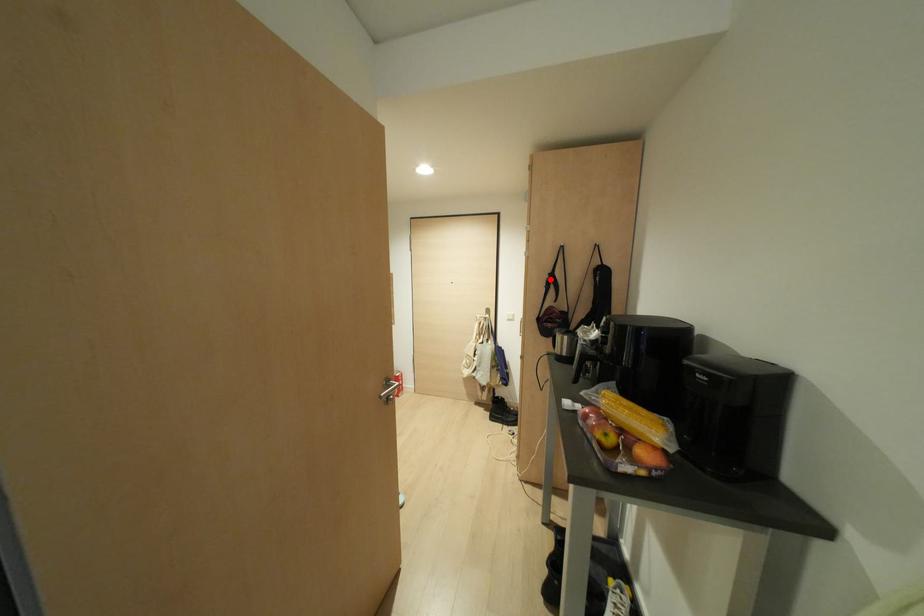
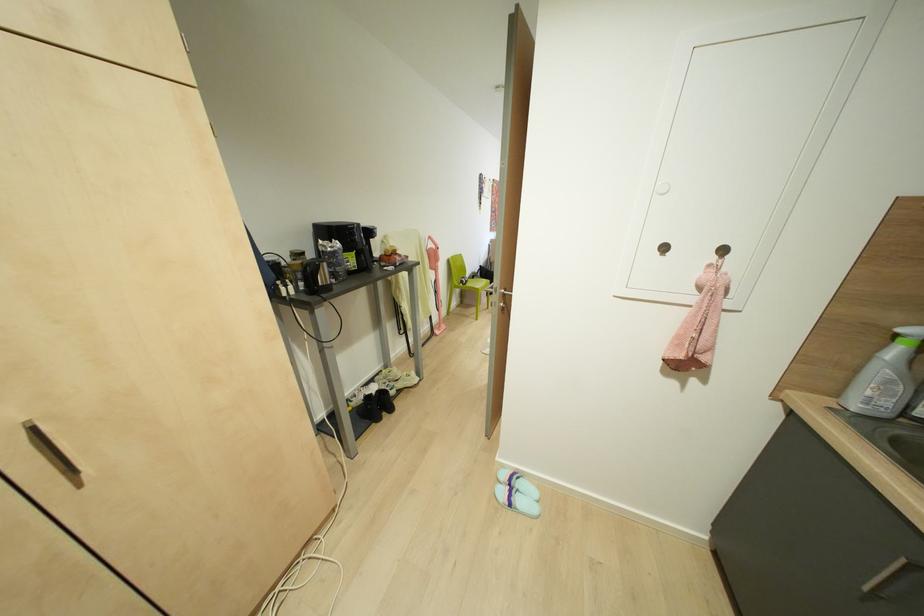
Question: I am providing you with two images of the same scene from different viewpoints. A red point is marked on the first image. Can you still see the location of the red point in image 2?

Choices:
 (A) Yes
 (B) No

Answer: (B)